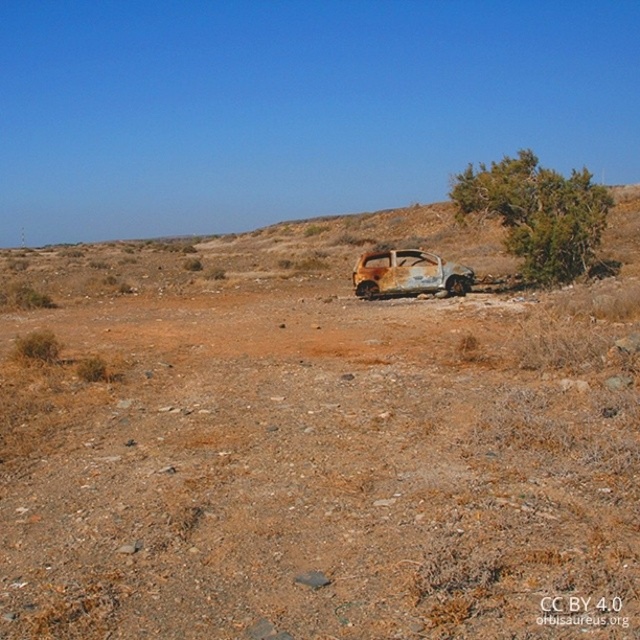
Is green leafy bush at center smaller than rusty metal car at center?

Incorrect, green leafy bush at center is not smaller in size than rusty metal car at center.

The image size is (640, 640). In order to click on green leafy bush at center in this screenshot , I will do `click(538, 212)`.